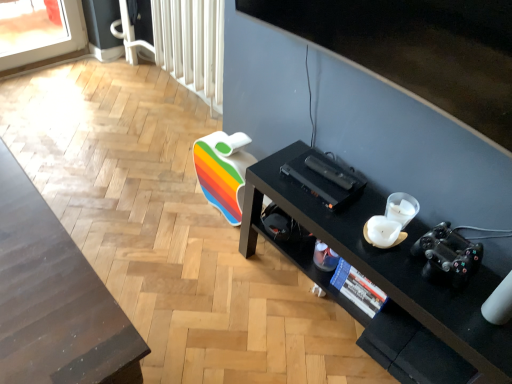
This screenshot has width=512, height=384. Identify the location of free location to the left of black matte desk at lower right. (207, 289).